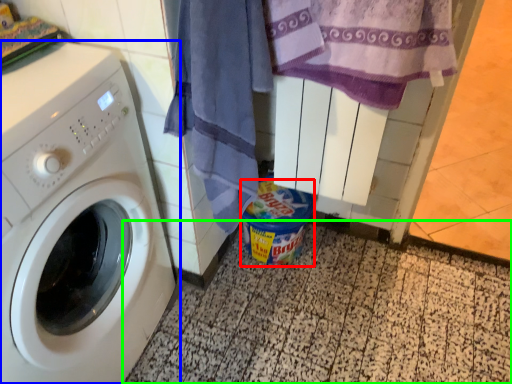
Question: Which object is the farthest from garbage (highlighted by a red box)? Choose among these: washing machine (highlighted by a blue box) or tile (highlighted by a green box).

Choices:
 (A) washing machine
 (B) tile

Answer: (A)